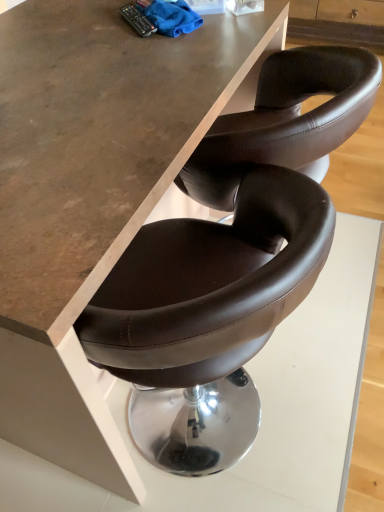
Identify the location of free space above matte brown leather table at center (from a real-world perspective). (96, 62).